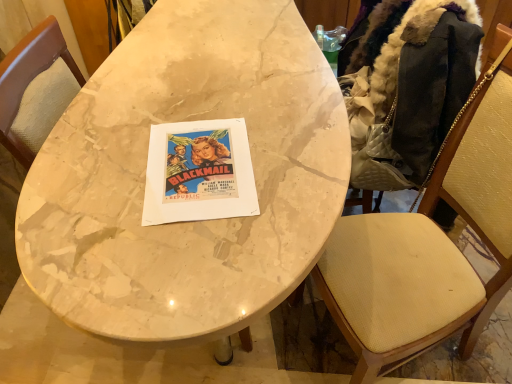
Question: Does dark brown fur-lined jacket at right have a lesser width compared to marble table at center?

Choices:
 (A) no
 (B) yes

Answer: (B)

Question: Can you confirm if dark brown fur-lined jacket at right is positioned to the right of marble table at center?

Choices:
 (A) yes
 (B) no

Answer: (A)

Question: From a real-world perspective, is dark brown fur-lined jacket at right under marble table at center?

Choices:
 (A) yes
 (B) no

Answer: (B)

Question: Is dark brown fur-lined jacket at right not near marble table at center?

Choices:
 (A) yes
 (B) no

Answer: (B)

Question: Is dark brown fur-lined jacket at right aimed at marble table at center?

Choices:
 (A) yes
 (B) no

Answer: (B)

Question: From the image's perspective, does dark brown fur-lined jacket at right appear lower than marble table at center?

Choices:
 (A) no
 (B) yes

Answer: (A)

Question: Is wooden textured chair at right surrounded by marble table at center?

Choices:
 (A) yes
 (B) no

Answer: (B)

Question: Can you confirm if marble table at center is taller than wooden textured chair at right?

Choices:
 (A) yes
 (B) no

Answer: (B)

Question: Considering the relative sizes of marble table at center and wooden textured chair at right in the image provided, is marble table at center bigger than wooden textured chair at right?

Choices:
 (A) yes
 (B) no

Answer: (A)

Question: Considering the relative positions of marble table at center and wooden textured chair at right in the image provided, is marble table at center behind wooden textured chair at right?

Choices:
 (A) yes
 (B) no

Answer: (A)

Question: Can you confirm if marble table at center is positioned to the right of wooden textured chair at right?

Choices:
 (A) yes
 (B) no

Answer: (B)

Question: Is the position of marble table at center less distant than that of wooden textured chair at right?

Choices:
 (A) no
 (B) yes

Answer: (A)

Question: Is marble table at center completely or partially outside of dark brown fur-lined jacket at right?

Choices:
 (A) yes
 (B) no

Answer: (A)